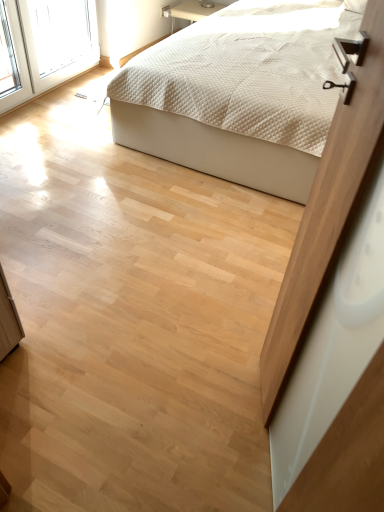
Question: Which is correct: white quilted fabric bed at upper center is inside matte wood screen door at upper right, or outside of it?

Choices:
 (A) inside
 (B) outside

Answer: (B)

Question: From a real-world perspective, is white quilted fabric bed at upper center positioned above or below matte wood screen door at upper right?

Choices:
 (A) above
 (B) below

Answer: (B)

Question: Considering the relative positions of white quilted fabric bed at upper center and matte wood screen door at upper right in the image provided, is white quilted fabric bed at upper center to the left or to the right of matte wood screen door at upper right?

Choices:
 (A) right
 (B) left

Answer: (A)

Question: In the image, is matte wood screen door at upper right on the left side or the right side of white quilted fabric bed at upper center?

Choices:
 (A) left
 (B) right

Answer: (A)

Question: Does point (284, 281) appear closer or farther from the camera than point (279, 131)?

Choices:
 (A) farther
 (B) closer

Answer: (B)

Question: Relative to white quilted fabric bed at upper center, is matte wood screen door at upper right in front or behind?

Choices:
 (A) behind
 (B) front

Answer: (B)

Question: Considering the positions of matte wood screen door at upper right and white quilted fabric bed at upper center in the image, is matte wood screen door at upper right taller or shorter than white quilted fabric bed at upper center?

Choices:
 (A) short
 (B) tall

Answer: (B)